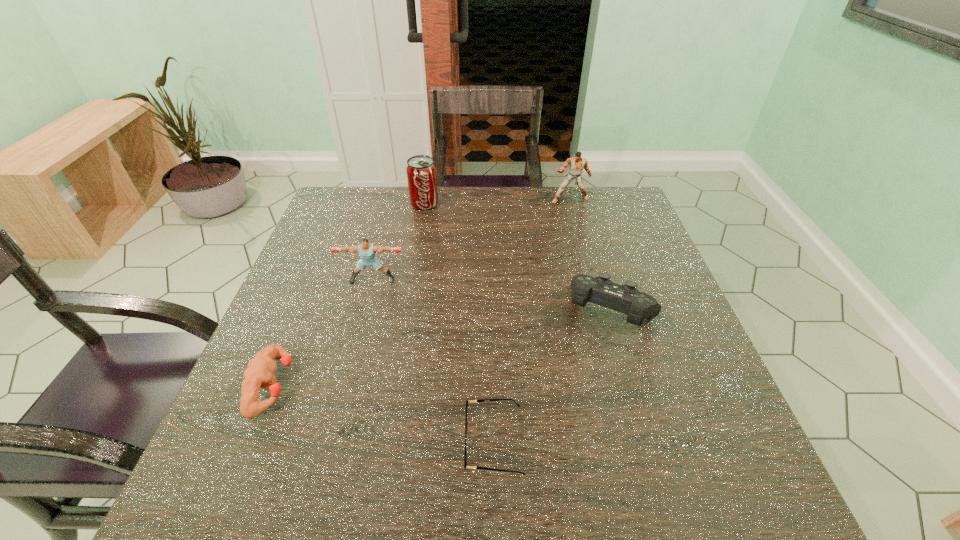
Find the location of a particular element. free space located on the front-facing side of the tallest puncher is located at coordinates (593, 283).

Where is `free space located on the right of the pop soda`? free space located on the right of the pop soda is located at coordinates (552, 204).

At what (x,y) coordinates should I click in order to perform the action: click on free location located on the front-facing side of the second puncher from left to right. Please return your answer as a coordinate pair (x, y). The width and height of the screenshot is (960, 540). Looking at the image, I should click on (345, 386).

I want to click on vacant space located 0.290m on the back of the third shortest object, so click(x=584, y=218).

You are a GUI agent. You are given a task and a screenshot of the screen. Output one action in this format:
    pyautogui.click(x=<x>, y=<y>)
    Task: Click on the vacant area situated 0.260m with the gloves of the leftmost puncher facing forward
    The width and height of the screenshot is (960, 540).
    Given the screenshot: What is the action you would take?
    pyautogui.click(x=423, y=385)

Locate an element on the screen. vacant area situated on the front-facing side of the third object from right to left is located at coordinates (415, 443).

The image size is (960, 540). Identify the location of free space located 0.320m on the front-facing side of the third object from right to left. (285, 443).

Image resolution: width=960 pixels, height=540 pixels. What are the coordinates of `free space located on the front-facing side of the third object from right to left` in the screenshot? It's located at click(387, 443).

I want to click on puncher positioned at the far edge, so click(577, 164).

You are a GUI agent. You are given a task and a screenshot of the screen. Output one action in this format:
    pyautogui.click(x=<x>, y=<y>)
    Task: Click on the pop soda present at the far edge
    
    Given the screenshot: What is the action you would take?
    pyautogui.click(x=421, y=171)